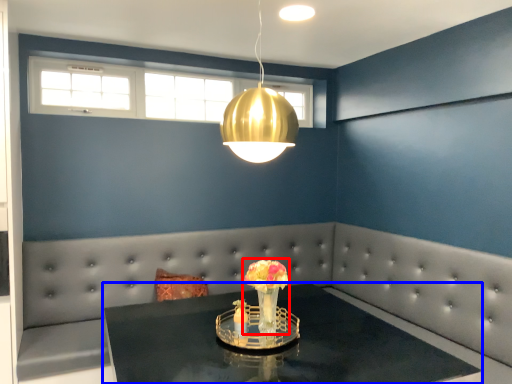
Question: Among these objects, which one is farthest to the camera, floral arrangement (highlighted by a red box) or table (highlighted by a blue box)?

Choices:
 (A) floral arrangement
 (B) table

Answer: (A)